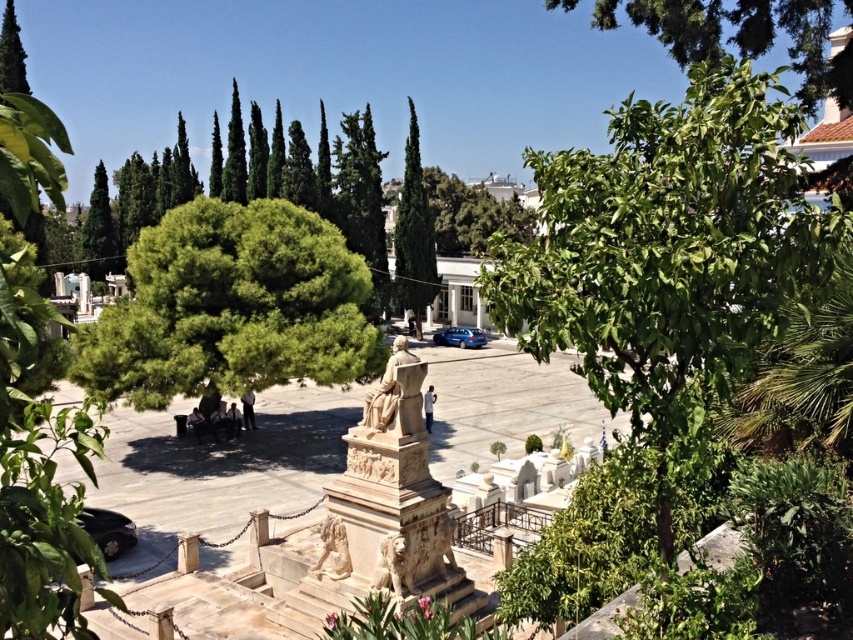
Who is taller, marble lion at center or satin blue sedan at center?

marble lion at center

Is marble lion at center positioned in front of satin blue sedan at center?

Yes, marble lion at center is in front of satin blue sedan at center.

Which is in front, point (389, 541) or point (440, 342)?

Positioned in front is point (389, 541).

This screenshot has width=853, height=640. Identify the location of marble lion at center. (393, 564).

Does green leafy tree at upper center appear on the left side of green leafy tree at upper left?

No, green leafy tree at upper center is not to the left of green leafy tree at upper left.

Looking at this image, is green leafy tree at upper center closer to the viewer compared to green leafy tree at upper left?

Yes, it is.

Image resolution: width=853 pixels, height=640 pixels. What do you see at coordinates (746, 35) in the screenshot? I see `green leafy tree at upper center` at bounding box center [746, 35].

This screenshot has height=640, width=853. I want to click on green leafy tree at upper center, so click(746, 35).

Is point (637, 413) less distant than point (656, 17)?

Yes, point (637, 413) is in front of point (656, 17).

This screenshot has width=853, height=640. What are the coordinates of `green leafy tree at upper right` in the screenshot? It's located at (668, 257).